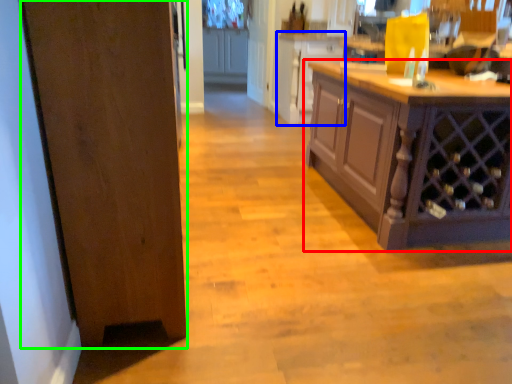
Question: Which object is the closest to the cabinetry (highlighted by a red box)? Choose among these: cabinetry (highlighted by a blue box) or door (highlighted by a green box).

Choices:
 (A) cabinetry
 (B) door

Answer: (B)